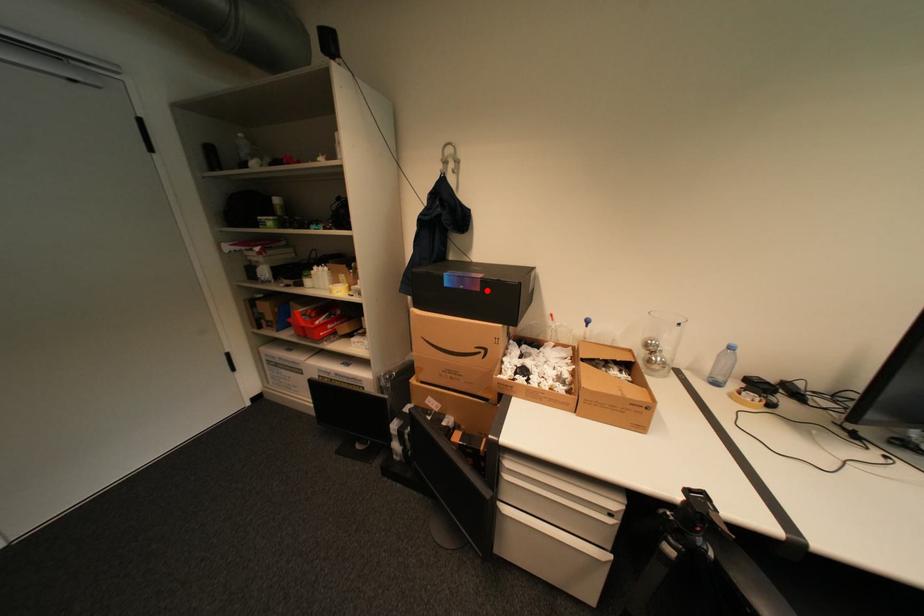
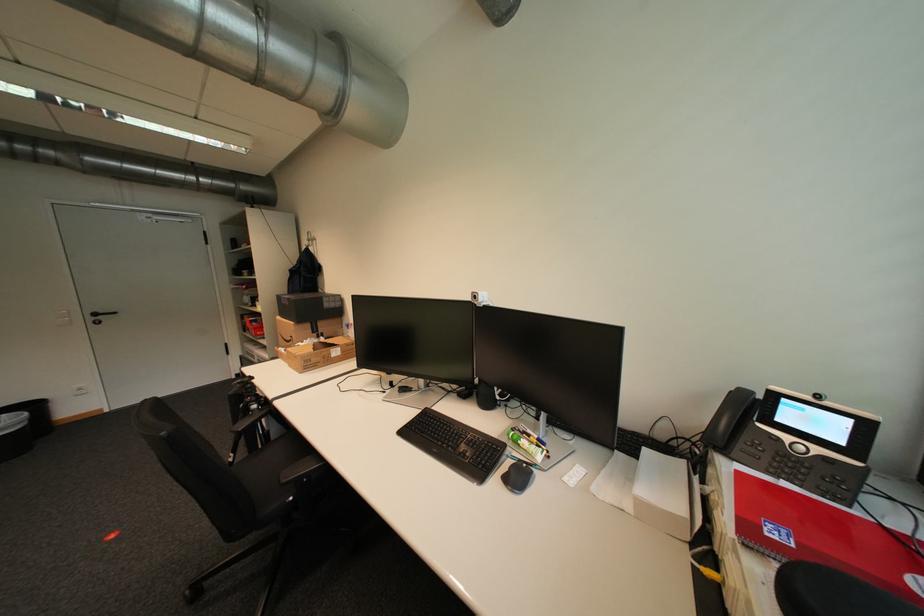
Where in the second image is the point corresponding to the highlighted location from the first image?

(296, 305)